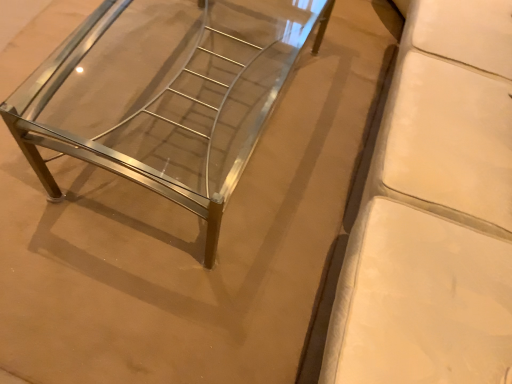
Measure the distance between white leather couch at right, acting as the 2th furniture starting from the left, and camera.

92.83 centimeters.

Locate an element on the screen. The image size is (512, 384). white leather couch at right, the first furniture when ordered from right to left is located at coordinates (434, 211).

Describe the element at coordinates (434, 211) in the screenshot. I see `white leather couch at right, the first furniture when ordered from right to left` at that location.

How much space does polished chrome bench at center, positioned as the first furniture in left-to-right order, occupy vertically?

polished chrome bench at center, positioned as the first furniture in left-to-right order, is 19.62 inches tall.

Where is `polished chrome bench at center, positioned as the first furniture in left-to-right order`? polished chrome bench at center, positioned as the first furniture in left-to-right order is located at coordinates (173, 101).

Image resolution: width=512 pixels, height=384 pixels. Describe the element at coordinates (173, 101) in the screenshot. I see `polished chrome bench at center, positioned as the first furniture in left-to-right order` at that location.

Where is `white leather couch at right, the first furniture when ordered from right to left`? white leather couch at right, the first furniture when ordered from right to left is located at coordinates (434, 211).

Which object is positioned more to the right, polished chrome bench at center, which is the second furniture from right to left, or white leather couch at right, the first furniture when ordered from right to left?

From the viewer's perspective, white leather couch at right, the first furniture when ordered from right to left, appears more on the right side.

Which object is further away from the camera, polished chrome bench at center, which is the second furniture from right to left, or white leather couch at right, the first furniture when ordered from right to left?

polished chrome bench at center, which is the second furniture from right to left, is further away from the camera.

Which is in front, point (132, 127) or point (446, 326)?

The point (446, 326) is closer to the camera.

Based on the photo, from the image's perspective, is polished chrome bench at center, which is the second furniture from right to left, beneath white leather couch at right, acting as the 2th furniture starting from the left?

No, from the image's perspective, polished chrome bench at center, which is the second furniture from right to left, is not below white leather couch at right, acting as the 2th furniture starting from the left.

From a real-world perspective, who is located lower, polished chrome bench at center, positioned as the first furniture in left-to-right order, or white leather couch at right, the first furniture when ordered from right to left?

From a 3D spatial view, polished chrome bench at center, positioned as the first furniture in left-to-right order, is below.

Which of these two, polished chrome bench at center, which is the second furniture from right to left, or white leather couch at right, acting as the 2th furniture starting from the left, is thinner?

With smaller width is polished chrome bench at center, which is the second furniture from right to left.

Who is shorter, polished chrome bench at center, which is the second furniture from right to left, or white leather couch at right, acting as the 2th furniture starting from the left?

With less height is polished chrome bench at center, which is the second furniture from right to left.

Looking at the image, does polished chrome bench at center, which is the second furniture from right to left, seem bigger or smaller compared to white leather couch at right, acting as the 2th furniture starting from the left?

Considering their sizes, polished chrome bench at center, which is the second furniture from right to left, takes up less space than white leather couch at right, acting as the 2th furniture starting from the left.

Is white leather couch at right, the first furniture when ordered from right to left, completely or partially inside polished chrome bench at center, which is the second furniture from right to left?

Actually, white leather couch at right, the first furniture when ordered from right to left, is outside polished chrome bench at center, which is the second furniture from right to left.

Is polished chrome bench at center, which is the second furniture from right to left, touching white leather couch at right, acting as the 2th furniture starting from the left?

No, polished chrome bench at center, which is the second furniture from right to left, is not with white leather couch at right, acting as the 2th furniture starting from the left.

Is polished chrome bench at center, positioned as the first furniture in left-to-right order, positioned with its back to white leather couch at right, the first furniture when ordered from right to left?

Yes, polished chrome bench at center, positioned as the first furniture in left-to-right order, is positioned with its back facing white leather couch at right, the first furniture when ordered from right to left.

Can you tell me how much polished chrome bench at center, positioned as the first furniture in left-to-right order, and white leather couch at right, the first furniture when ordered from right to left, differ in facing direction?

The angle between the facing direction of polished chrome bench at center, positioned as the first furniture in left-to-right order, and the facing direction of white leather couch at right, the first furniture when ordered from right to left, is 4.33 degrees.

What are the coordinates of `furniture lying in front of the polished chrome bench at center, positioned as the first furniture in left-to-right order` in the screenshot? It's located at (434, 211).

Is white leather couch at right, the first furniture when ordered from right to left, to the left of polished chrome bench at center, which is the second furniture from right to left, from the viewer's perspective?

No, white leather couch at right, the first furniture when ordered from right to left, is not to the left of polished chrome bench at center, which is the second furniture from right to left.

Considering the positions of objects white leather couch at right, acting as the 2th furniture starting from the left, and polished chrome bench at center, which is the second furniture from right to left, in the image provided, who is behind, white leather couch at right, acting as the 2th furniture starting from the left, or polished chrome bench at center, which is the second furniture from right to left,?

polished chrome bench at center, which is the second furniture from right to left, is further from the camera.

Is point (421, 328) closer or farther from the camera than point (251, 67)?

Point (421, 328).

From the image's perspective, is white leather couch at right, the first furniture when ordered from right to left, positioned above or below polished chrome bench at center, which is the second furniture from right to left?

Clearly, from the image's perspective, white leather couch at right, the first furniture when ordered from right to left, is below polished chrome bench at center, which is the second furniture from right to left.

From a real-world perspective, between white leather couch at right, acting as the 2th furniture starting from the left, and polished chrome bench at center, which is the second furniture from right to left, who is vertically lower?

polished chrome bench at center, which is the second furniture from right to left, from a real-world perspective.

Based on the photo, is white leather couch at right, acting as the 2th furniture starting from the left, wider than polished chrome bench at center, positioned as the first furniture in left-to-right order?

Yes, white leather couch at right, acting as the 2th furniture starting from the left, is wider than polished chrome bench at center, positioned as the first furniture in left-to-right order.

Who is taller, white leather couch at right, acting as the 2th furniture starting from the left, or polished chrome bench at center, positioned as the first furniture in left-to-right order?

white leather couch at right, acting as the 2th furniture starting from the left, is taller.

Can you confirm if white leather couch at right, acting as the 2th furniture starting from the left, is smaller than polished chrome bench at center, positioned as the first furniture in left-to-right order?

No, white leather couch at right, acting as the 2th furniture starting from the left, is not smaller than polished chrome bench at center, positioned as the first furniture in left-to-right order.

Can we say white leather couch at right, the first furniture when ordered from right to left, lies outside polished chrome bench at center, positioned as the first furniture in left-to-right order?

Yes, white leather couch at right, the first furniture when ordered from right to left, is not within polished chrome bench at center, positioned as the first furniture in left-to-right order.

Is there a large distance between white leather couch at right, acting as the 2th furniture starting from the left, and polished chrome bench at center, which is the second furniture from right to left?

No, white leather couch at right, acting as the 2th furniture starting from the left, is not far from polished chrome bench at center, which is the second furniture from right to left.

Is white leather couch at right, the first furniture when ordered from right to left, aimed at polished chrome bench at center, positioned as the first furniture in left-to-right order?

Yes, white leather couch at right, the first furniture when ordered from right to left, faces towards polished chrome bench at center, positioned as the first furniture in left-to-right order.

Measure the distance from white leather couch at right, acting as the 2th furniture starting from the left, to polished chrome bench at center, which is the second furniture from right to left.

white leather couch at right, acting as the 2th furniture starting from the left, is 28.64 inches away from polished chrome bench at center, which is the second furniture from right to left.

The image size is (512, 384). What are the coordinates of `furniture lying on the left of white leather couch at right, the first furniture when ordered from right to left` in the screenshot? It's located at (173, 101).

Locate an element on the screen. The height and width of the screenshot is (384, 512). furniture that appears behind the white leather couch at right, the first furniture when ordered from right to left is located at coordinates tap(173, 101).

Where is `furniture that is under the white leather couch at right, acting as the 2th furniture starting from the left (from a real-world perspective)`? This screenshot has height=384, width=512. furniture that is under the white leather couch at right, acting as the 2th furniture starting from the left (from a real-world perspective) is located at coordinates (173, 101).